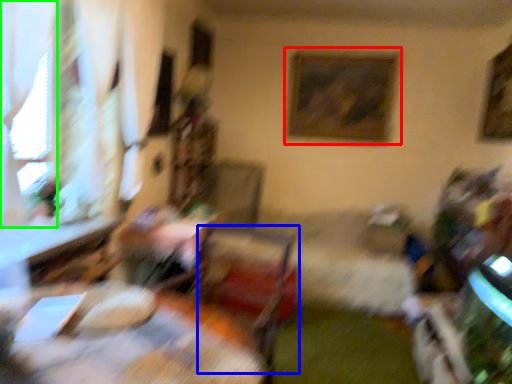
Question: Based on their relative distances, which object is farther from picture frame (highlighted by a red box)? Choose from swivel chair (highlighted by a blue box) and window (highlighted by a green box).

Choices:
 (A) swivel chair
 (B) window

Answer: (B)